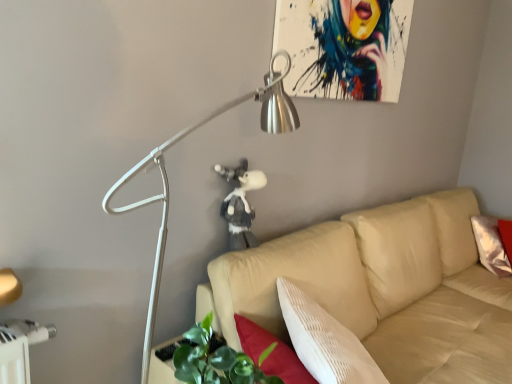
Question: Is fluffy gray plush at center positioned far away from metallic silver lamp at upper left?

Choices:
 (A) yes
 (B) no

Answer: (B)

Question: Does fluffy gray plush at center have a smaller size compared to metallic silver lamp at upper left?

Choices:
 (A) no
 (B) yes

Answer: (B)

Question: From the image's perspective, would you say fluffy gray plush at center is positioned over metallic silver lamp at upper left?

Choices:
 (A) no
 (B) yes

Answer: (B)

Question: Can you confirm if fluffy gray plush at center is taller than metallic silver lamp at upper left?

Choices:
 (A) no
 (B) yes

Answer: (A)

Question: From a real-world perspective, does fluffy gray plush at center sit lower than metallic silver lamp at upper left?

Choices:
 (A) no
 (B) yes

Answer: (A)

Question: Considering the relative positions of fluffy gray plush at center and metallic silver lamp at upper left in the image provided, is fluffy gray plush at center to the left of metallic silver lamp at upper left from the viewer's perspective?

Choices:
 (A) yes
 (B) no

Answer: (B)

Question: Does metallic silver lamp at upper left have a smaller size compared to fluffy gray plush at center?

Choices:
 (A) yes
 (B) no

Answer: (B)

Question: From a real-world perspective, is metallic silver lamp at upper left physically above fluffy gray plush at center?

Choices:
 (A) yes
 (B) no

Answer: (B)

Question: Is the depth of metallic silver lamp at upper left less than that of fluffy gray plush at center?

Choices:
 (A) no
 (B) yes

Answer: (B)

Question: Could you tell me if metallic silver lamp at upper left is turned towards fluffy gray plush at center?

Choices:
 (A) no
 (B) yes

Answer: (A)

Question: Is metallic silver lamp at upper left to the right of fluffy gray plush at center from the viewer's perspective?

Choices:
 (A) yes
 (B) no

Answer: (B)

Question: Is metallic silver lamp at upper left with fluffy gray plush at center?

Choices:
 (A) yes
 (B) no

Answer: (B)

Question: Considering the relative positions of fluffy gray plush at center and beige fabric couch at center in the image provided, is fluffy gray plush at center to the left of beige fabric couch at center from the viewer's perspective?

Choices:
 (A) no
 (B) yes

Answer: (B)